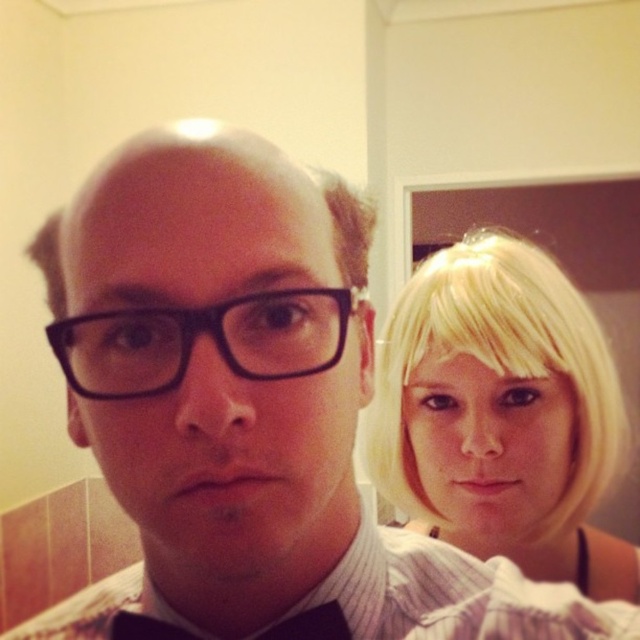
Question: Does blonde hair at upper right appear over matte black bow tie at lower center?

Choices:
 (A) yes
 (B) no

Answer: (A)

Question: Does black plastic glasses at center appear on the left side of matte black bow tie at lower center?

Choices:
 (A) no
 (B) yes

Answer: (A)

Question: Is blonde hair at upper right wider than matte black bow tie at lower center?

Choices:
 (A) yes
 (B) no

Answer: (A)

Question: Which object is farther from the camera taking this photo?

Choices:
 (A) matte black bow tie at lower center
 (B) blonde hair at upper right

Answer: (B)

Question: Which point is farther to the camera?

Choices:
 (A) (285, 632)
 (B) (225, 339)
 (C) (392, 461)

Answer: (C)

Question: Among these objects, which one is nearest to the camera?

Choices:
 (A) matte black bow tie at lower center
 (B) black plastic glasses at center

Answer: (B)